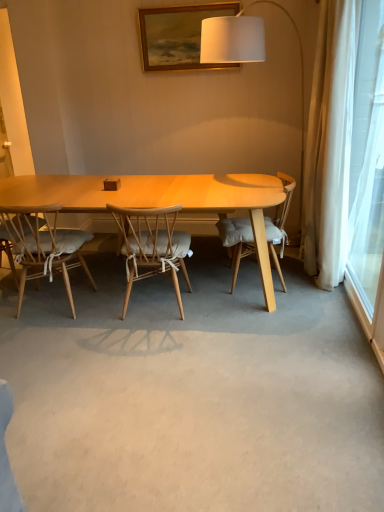
The width and height of the screenshot is (384, 512). I want to click on free space in front of light wood chair with white cushion at left, acting as the third chair starting from the right, so click(54, 338).